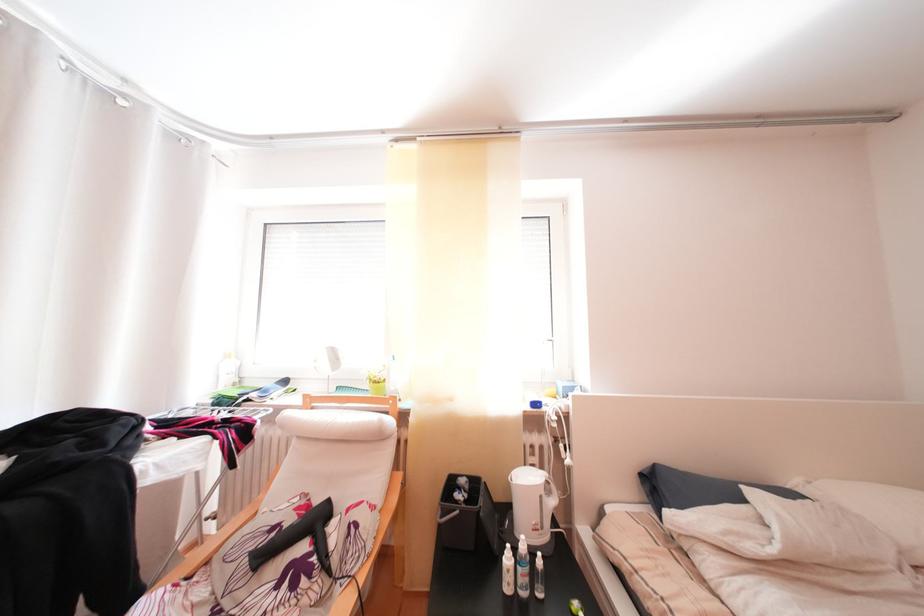
Image resolution: width=924 pixels, height=616 pixels. I want to click on white kettle handle, so click(x=551, y=493).